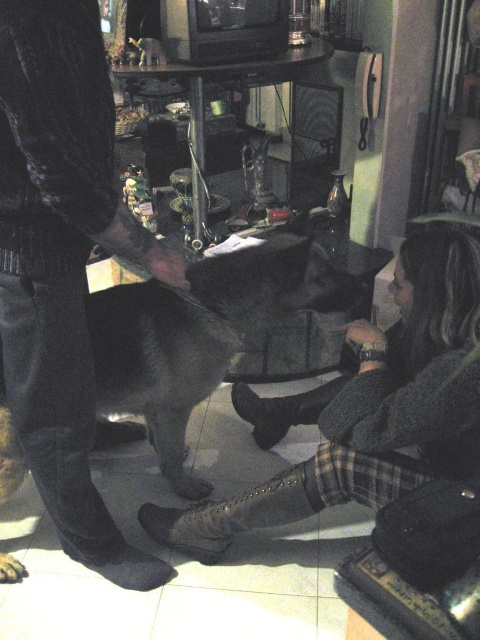
Where is `dark gray sweater at center`? dark gray sweater at center is located at coordinates (373, 406).

Is dark gray sweater at center smaller than shiny black dog at center?

No.

Does point (395, 337) lie in front of point (193, 490)?

Yes, it is.

In order to click on dark gray sweater at center in this screenshot , I will do `click(373, 406)`.

At what (x,y) coordinates should I click in order to perform the action: click on dark corduroy pants at left. Please return your answer as a coordinate pair (x, y). This screenshot has width=480, height=640. Looking at the image, I should click on (62, 262).

Is point (91, 88) positioned before point (180, 433)?

Yes, it is in front of point (180, 433).

Locate an element on the screen. The height and width of the screenshot is (640, 480). dark corduroy pants at left is located at coordinates (62, 262).

Where is `dark corduroy pants at left`? The width and height of the screenshot is (480, 640). dark corduroy pants at left is located at coordinates (62, 262).

Which is below, dark corduroy pants at left or leather boot at lower center?

leather boot at lower center is below.

Is dark corduroy pants at left to the left of leather boot at lower center from the viewer's perspective?

Correct, you'll find dark corduroy pants at left to the left of leather boot at lower center.

Who is more distant from viewer, (44, 317) or (315, 483)?

The point (315, 483) is more distant.

This screenshot has width=480, height=640. I want to click on dark corduroy pants at left, so click(x=62, y=262).